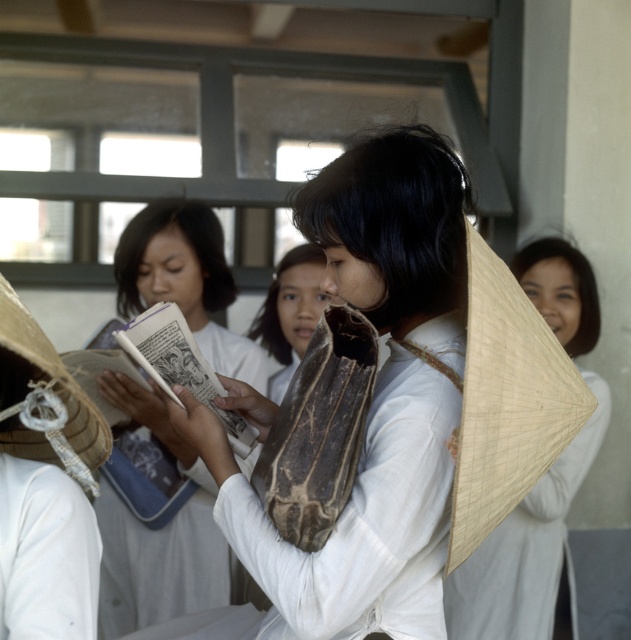
Does natural straw hat at center appear under natural straw hat at left?

Indeed, natural straw hat at center is positioned under natural straw hat at left.

Who is more distant from viewer, (528, 632) or (93, 444)?

The point (528, 632) is behind.

Is point (558, 257) farther from viewer compared to point (37, 324)?

Yes, it is behind point (37, 324).

Find the location of a particular element. This screenshot has width=631, height=640. natural straw hat at center is located at coordinates (526, 547).

From the picture: Who is higher up, matte brown bag at center or natural straw hat at center?

Positioned higher is matte brown bag at center.

Who is shorter, matte brown bag at center or natural straw hat at center?

matte brown bag at center is shorter.

Between point (387, 216) and point (459, 580), which one is positioned in front?

Positioned in front is point (387, 216).

At what (x,y) coordinates should I click in order to perform the action: click on matte brown bag at center. Please return your answer as a coordinate pair (x, y). The image size is (631, 640). Looking at the image, I should click on (370, 406).

Is matte brown bag at center bigger than white paper book at center?

Yes, matte brown bag at center is bigger than white paper book at center.

Is matte brown bag at center smaller than white paper book at center?

No, matte brown bag at center is not smaller than white paper book at center.

Is point (466, 273) closer to viewer compared to point (141, 236)?

Yes, it is.

The height and width of the screenshot is (640, 631). Find the location of `matte brown bag at center`. matte brown bag at center is located at coordinates (370, 406).